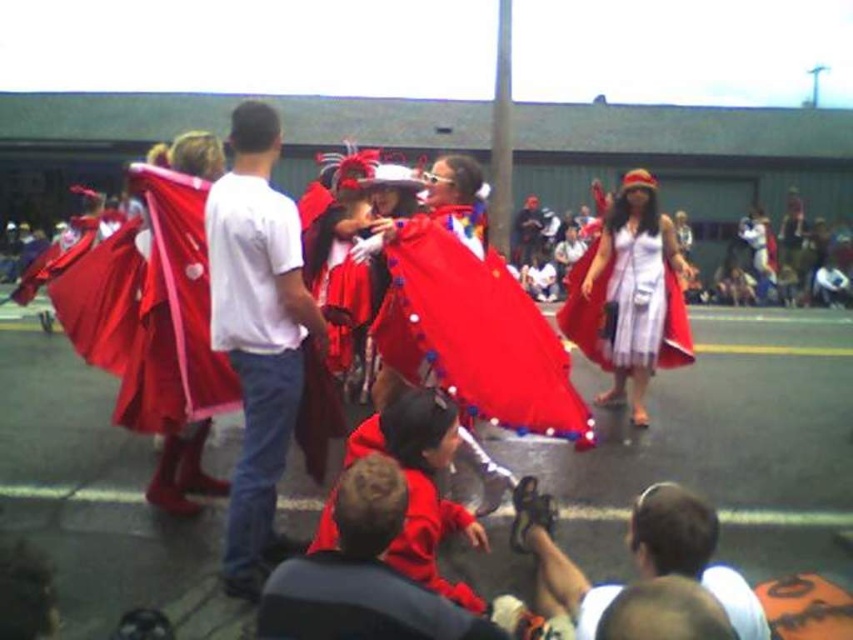
Who is taller, red velvet cape at center or dark blue jeans at center?

dark blue jeans at center is taller.

Does red velvet cape at center have a larger size compared to dark blue jeans at center?

No.

Image resolution: width=853 pixels, height=640 pixels. In order to click on red velvet cape at center in this screenshot , I will do `click(361, 573)`.

What are the coordinates of `red velvet cape at center` in the screenshot? It's located at (361, 573).

How much distance is there between red velvet cape at center and matte black sandals at lower center?

67.68 centimeters

From the picture: Between red velvet cape at center and matte black sandals at lower center, which one has more height?

matte black sandals at lower center

Which is behind, point (347, 554) or point (659, 547)?

The point (347, 554) is more distant.

This screenshot has width=853, height=640. In order to click on red velvet cape at center in this screenshot , I will do (x=361, y=573).

Does shiny red cape at center have a lesser width compared to dark blue jeans at center?

In fact, shiny red cape at center might be wider than dark blue jeans at center.

Does point (466, 289) lie behind point (521, 260)?

No, (466, 289) is closer to viewer.

Image resolution: width=853 pixels, height=640 pixels. What are the coordinates of `shiny red cape at center` in the screenshot? It's located at (467, 316).

This screenshot has width=853, height=640. What are the coordinates of `shiny red cape at center` in the screenshot? It's located at (467, 316).